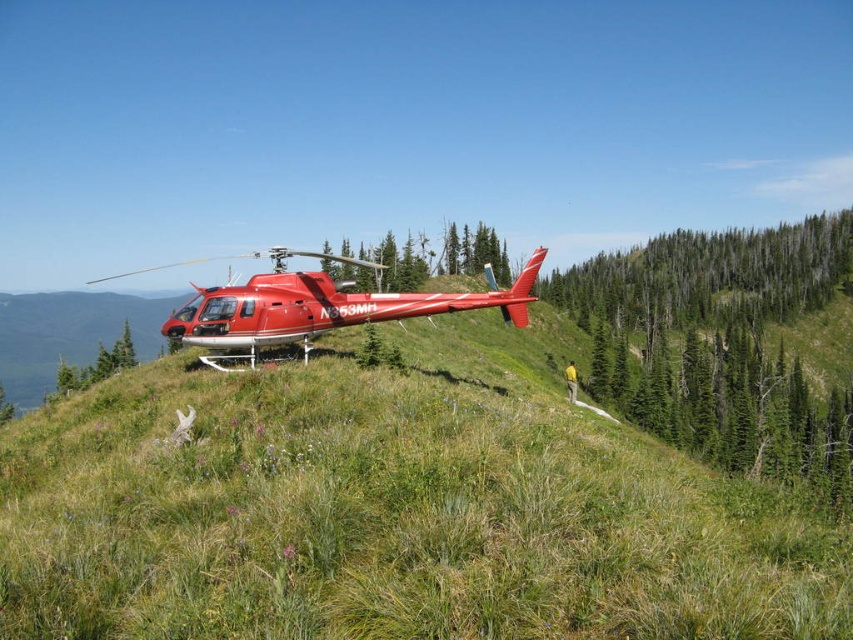
Can you confirm if shiny red helicopter at center is smaller than green textured tree at center?

No, shiny red helicopter at center is not smaller than green textured tree at center.

Between shiny red helicopter at center and green textured tree at center, which one is positioned higher?

shiny red helicopter at center

The width and height of the screenshot is (853, 640). What do you see at coordinates (317, 305) in the screenshot? I see `shiny red helicopter at center` at bounding box center [317, 305].

The width and height of the screenshot is (853, 640). Identify the location of shiny red helicopter at center. (317, 305).